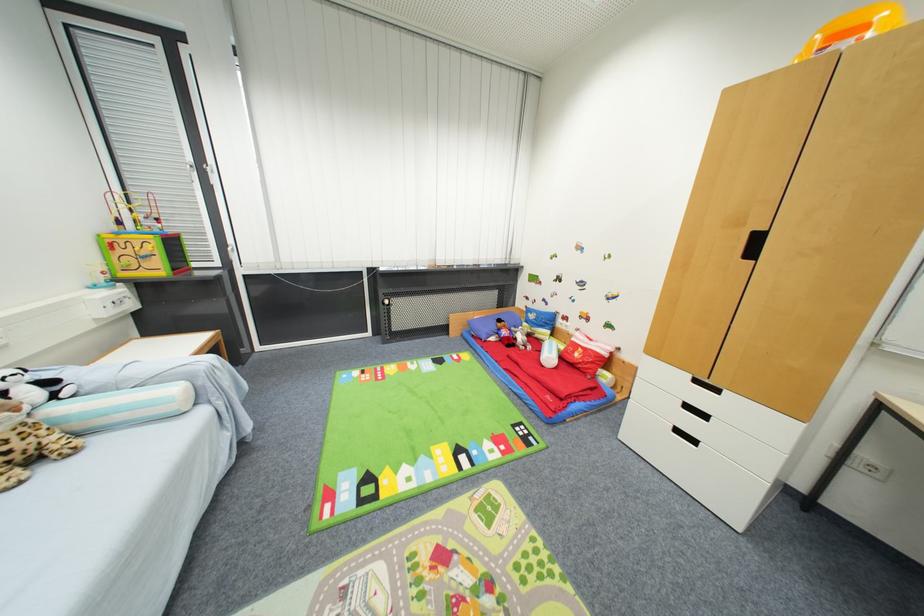
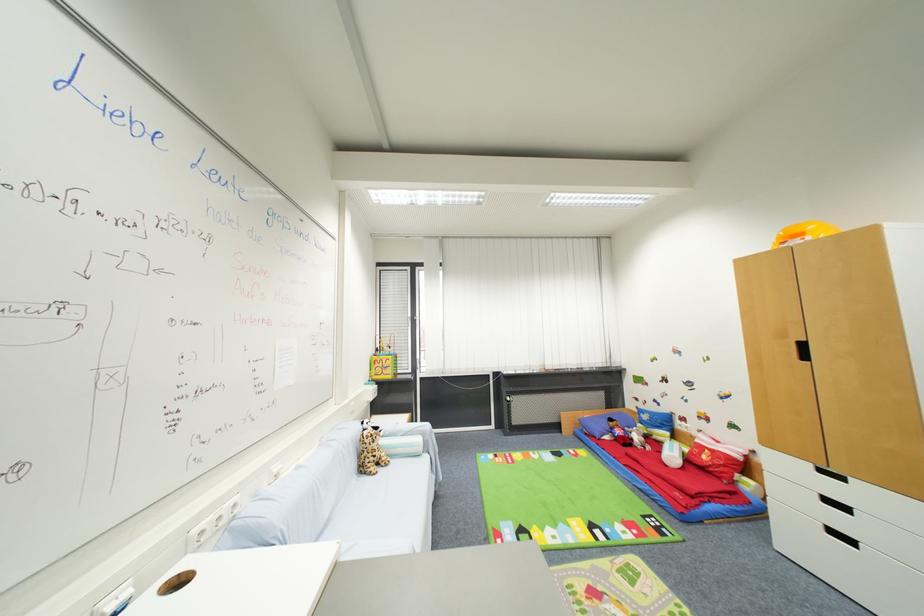
The point at (52, 471) is marked in the first image. Where is the corresponding point in the second image?

(385, 472)